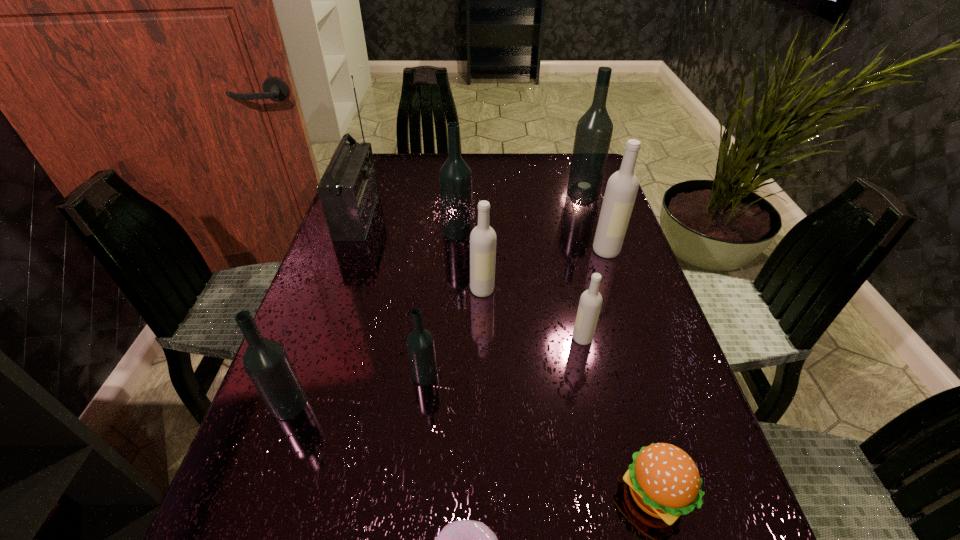
Identify the location of free point that satisfies the following two spatial constraints: 1. on the front side of the biggest black vodka; 2. on the front panel of the radio receiver. The height and width of the screenshot is (540, 960). (590, 216).